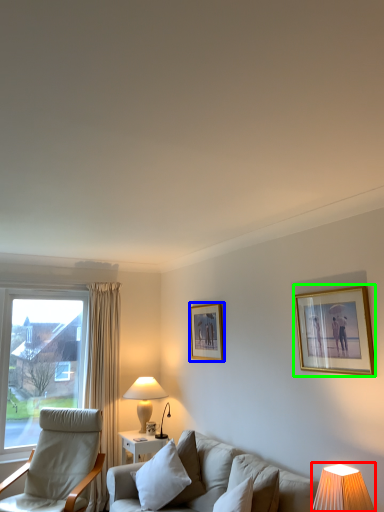
Question: Based on their relative distances, which object is farther from table lamp (highlighted by a red box)? Choose from picture frame (highlighted by a blue box) and picture frame (highlighted by a green box).

Choices:
 (A) picture frame
 (B) picture frame

Answer: (A)